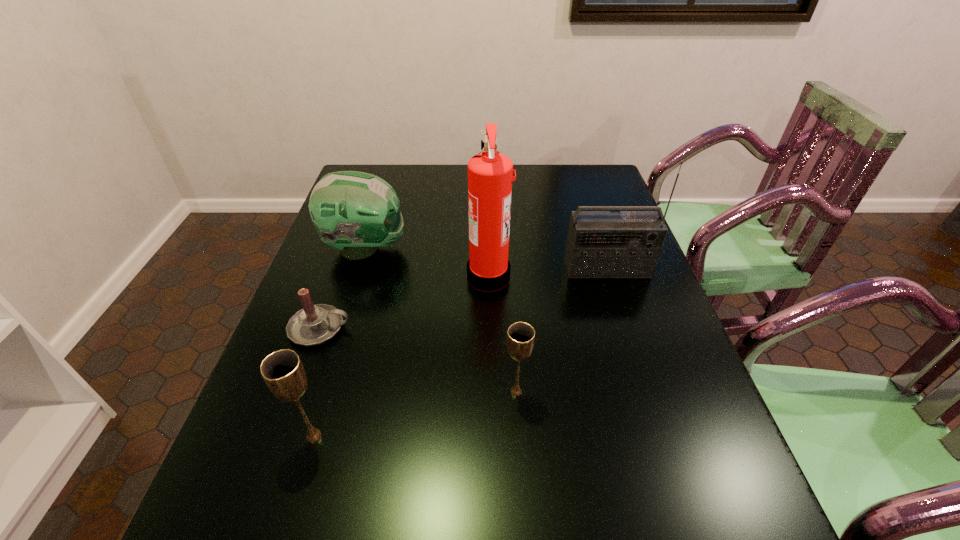
Find the location of a particular element. The height and width of the screenshot is (540, 960). object that can be found as the second closest to the football helmet is located at coordinates (490, 174).

You are a GUI agent. You are given a task and a screenshot of the screen. Output one action in this format:
    pyautogui.click(x=<x>, y=<y>)
    Task: Click on the vacant region that satisfies the following two spatial constraints: 1. on the back side of the shorter chalice; 2. on the right side of the nearest object
    
    Given the screenshot: What is the action you would take?
    pyautogui.click(x=327, y=392)

The image size is (960, 540). I want to click on free region that satisfies the following two spatial constraints: 1. on the visor of the football helmet; 2. on the right side of the nearer chalice, so click(307, 436).

Find the location of `free location that satisfies the following two spatial constraints: 1. on the visor of the football helmet; 2. on the back side of the second shortest object`. free location that satisfies the following two spatial constraints: 1. on the visor of the football helmet; 2. on the back side of the second shortest object is located at coordinates (321, 392).

The image size is (960, 540). Identify the location of free space that satisfies the following two spatial constraints: 1. on the front panel of the rightmost object; 2. on the side of the shortest object with the handle loop. (627, 328).

The width and height of the screenshot is (960, 540). What are the coordinates of `vacant space that satisfies the following two spatial constraints: 1. on the front panel of the rightmost object; 2. with the nozzle aimed from the fire extinguisher` in the screenshot? It's located at (609, 275).

Locate an element on the screen. This screenshot has width=960, height=540. vacant space that satisfies the following two spatial constraints: 1. on the side of the right chalice with the handle loop; 2. on the left side of the shortest object is located at coordinates (298, 392).

Find the location of a particular element. Image resolution: width=960 pixels, height=540 pixels. free space that satisfies the following two spatial constraints: 1. on the side of the shortest object with the handle loop; 2. on the back side of the second shortest object is located at coordinates (298, 392).